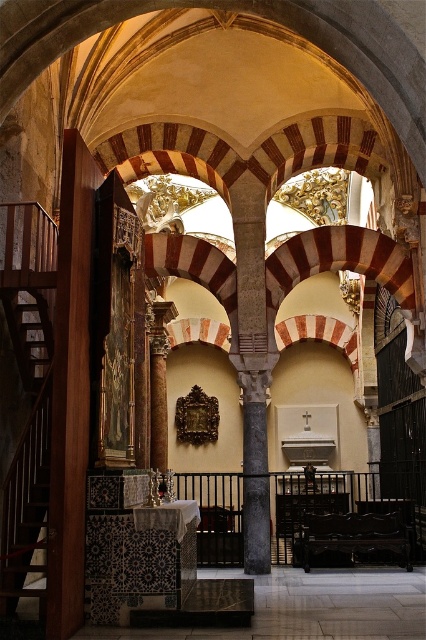
You are an architect assessing the accessibility of this historic building. You need to determine if a person of average height can comfortably reach the top step of the wooden staircase at left without standing on the polished dark wood bench at center. Can they?

The wooden staircase at left has a greater height compared to the polished dark wood bench at center, so a person of average height may need to use the bench to reach the top step of the wooden staircase at left.

You are an architect designing a new building inspired by this historic structure. You need to place a decorative column between the wooden staircase at left and the polished dark wood bench at center. Which object should the column be closer to if it needs to be narrower than both?

The column should be placed closer to the wooden staircase at left because it is thinner than the polished dark wood bench at center, so the column can be narrower while still fitting between them.